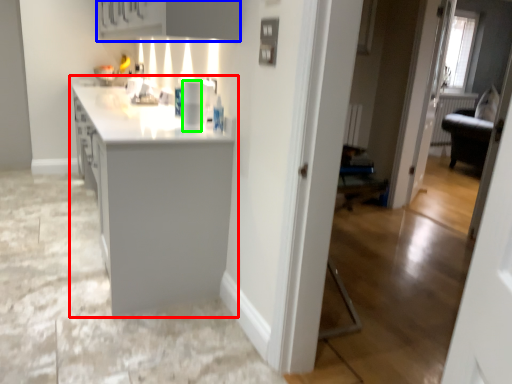
Question: Which is nearer to the countertop (highlighted by a red box)? cabinetry (highlighted by a blue box) or appliance (highlighted by a green box).

Choices:
 (A) cabinetry
 (B) appliance

Answer: (B)